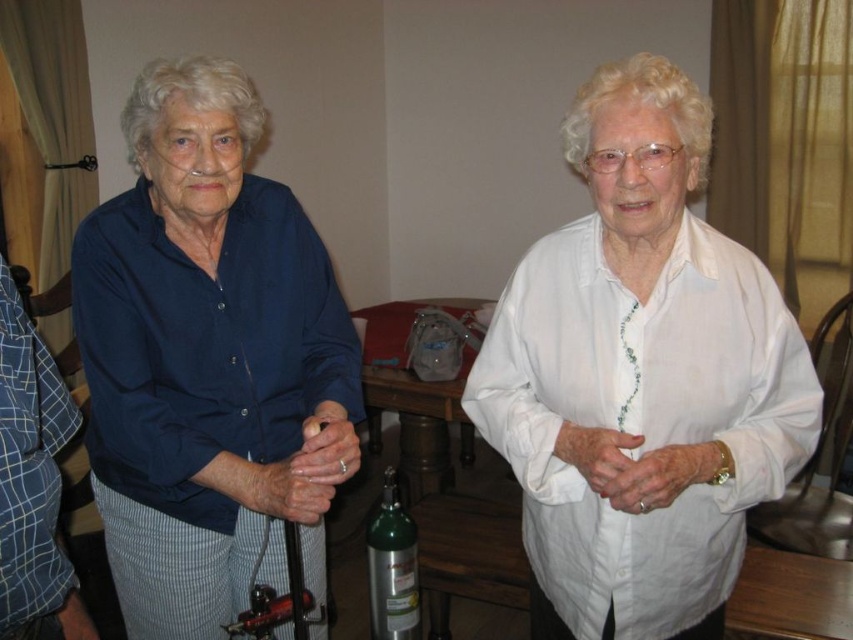
Is white cotton shirt at upper right taller than matte blue shirt at left?

Incorrect, white cotton shirt at upper right's height is not larger of matte blue shirt at left's.

Describe the element at coordinates (641, 378) in the screenshot. I see `white cotton shirt at upper right` at that location.

Where is `white cotton shirt at upper right`? The height and width of the screenshot is (640, 853). white cotton shirt at upper right is located at coordinates (641, 378).

Is point (282, 513) positioned before point (416, 566)?

Yes, point (282, 513) is in front of point (416, 566).

Which is behind, point (335, 404) or point (399, 556)?

The point (399, 556) is behind.

Locate an element on the screen. This screenshot has height=640, width=853. matte blue shirt at left is located at coordinates (207, 360).

Does white cotton shirt at upper right appear on the right side of silver metallic oxygen tank at center?

Correct, you'll find white cotton shirt at upper right to the right of silver metallic oxygen tank at center.

In the scene shown: Who is more forward, [612,196] or [392,572]?

Point [612,196] is in front.

The width and height of the screenshot is (853, 640). I want to click on white cotton shirt at upper right, so click(x=641, y=378).